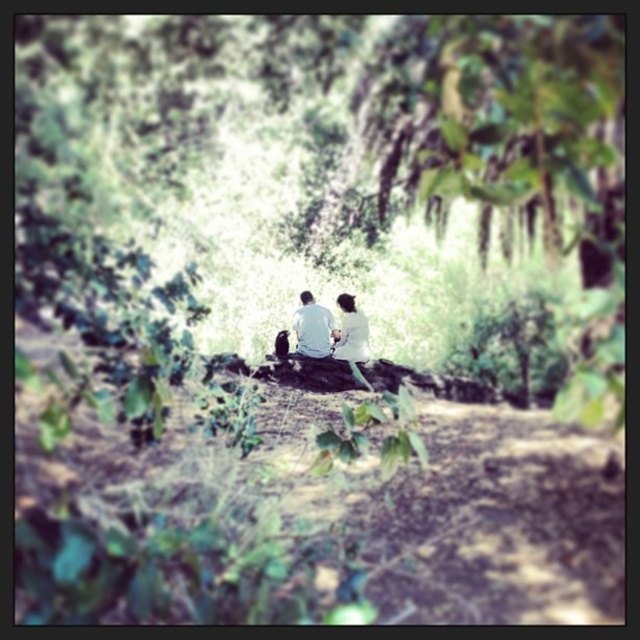
You are a photographer trying to capture the two individuals in the scene. You notice both the white cotton shirt at center and the white matte shirt at center. Which shirt will appear more prominent in the photo due to its size?

The white cotton shirt at center will appear more prominent in the photo because it is larger in size than the white matte shirt at center.

You are standing in the forest scene and want to place a small flower between the two points, point (310,340) and point (339,300). Since you want the flower to be closer to the front of the image, which point should you choose?

You should place the flower at point (310,340) because it is closer to the viewer than point (339,300).

You are a photographer trying to capture a closeup of the white cotton shirt at center. Based on the scene description, can you estimate the approximate coordinates where you should focus your camera lens?

The 2D location of the white cotton shirt at center is at point (332, 330), so you should focus your camera lens at those coordinates to capture the closeup.